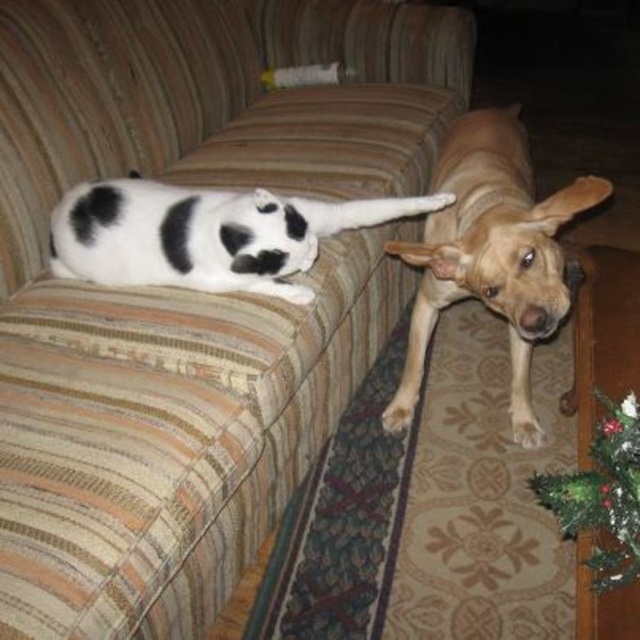
You are planning to place a new rectangular coffee table in the living room. The golden tan fur dog at right and the green textured christmas tree at lower right are both in the way. Which object should you move to make more space for the table?

You should move the golden tan fur dog at right because its width is greater than the green textured christmas tree at lower right, so removing it would free up more space for the coffee table.

You are a photographer trying to capture both the white fur at lower right and the light brown fur at lower right in a single frame. Given their sizes, which one might you need to position closer to the camera to ensure both fit well in the photo?

Since the white fur at lower right is smaller in width compared to the light brown fur at lower right, you should position the white fur at lower right closer to the camera to make them appear similar in size in the photo.